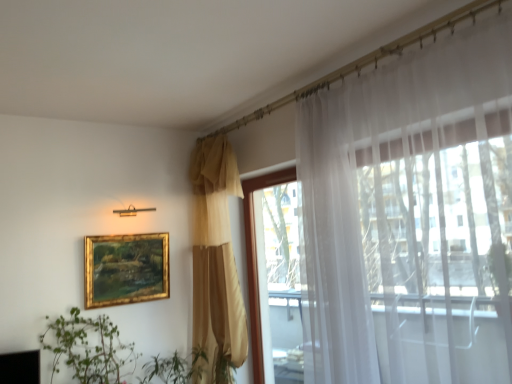
Question: In terms of width, does transparent glass window at upper right look wider or thinner when compared to green leafy plant at lower left?

Choices:
 (A) wide
 (B) thin

Answer: (B)

Question: From the image's perspective, is transparent glass window at upper right above or below green leafy plant at lower left?

Choices:
 (A) below
 (B) above

Answer: (B)

Question: Estimate the real-world distances between objects in this image. Which object is closer to the gold-framed painting at upper left?

Choices:
 (A) transparent glass window at upper right
 (B) white sheer curtain at right, which ranks as the first curtain in right-to-left order
 (C) green leafy plant at lower left
 (D) matte gold curtain at center, arranged as the second curtain when viewed from the right

Answer: (C)

Question: Considering the real-world distances, which object is farthest from the gold-framed painting at upper left?

Choices:
 (A) matte gold curtain at center, which is the 1th curtain in back-to-front order
 (B) transparent glass window at upper right
 (C) green leafy plant at lower left
 (D) white sheer curtain at right, which appears as the 2th curtain when viewed from the back

Answer: (D)